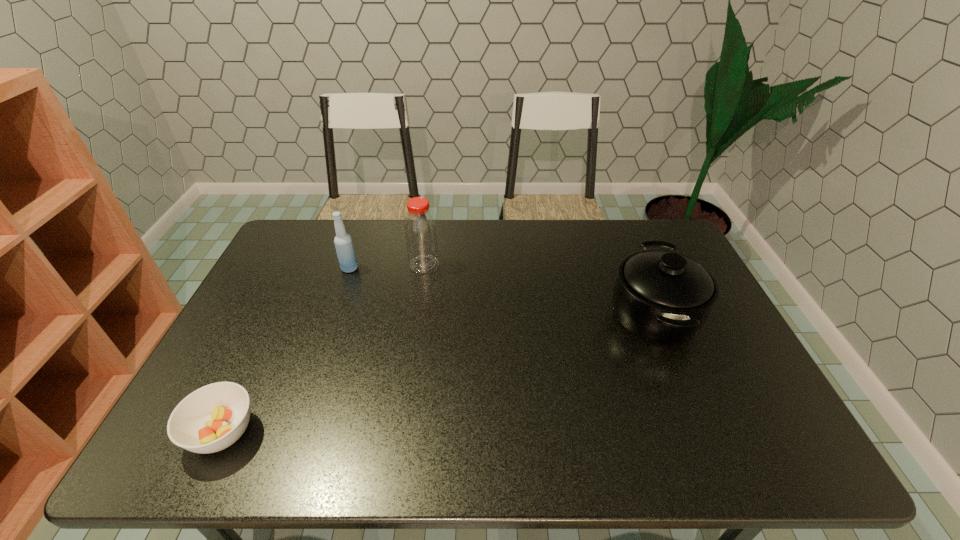
Image resolution: width=960 pixels, height=540 pixels. Find the location of `object at the near edge`. object at the near edge is located at coordinates click(213, 417).

Find the location of a particular element. This screenshot has height=540, width=960. object that is at the left edge is located at coordinates (213, 417).

In order to click on object that is at the right edge in this screenshot , I will do `click(661, 296)`.

At what (x,y) coordinates should I click in order to perform the action: click on object that is positioned at the near left corner. Please return your answer as a coordinate pair (x, y). Looking at the image, I should click on (213, 417).

Identify the location of free point at the far edge. (483, 245).

The width and height of the screenshot is (960, 540). In order to click on vacant space at the near edge of the desktop in this screenshot , I will do `click(721, 451)`.

In the image, there is a desktop. Identify the location of vacant space at the left edge. (258, 387).

Locate an element on the screen. The width and height of the screenshot is (960, 540). vacant area at the right edge of the desktop is located at coordinates pos(718,369).

I want to click on vacant point at the near right corner, so click(x=767, y=447).

This screenshot has width=960, height=540. I want to click on blank region between the right bottle and the shortest object, so click(324, 348).